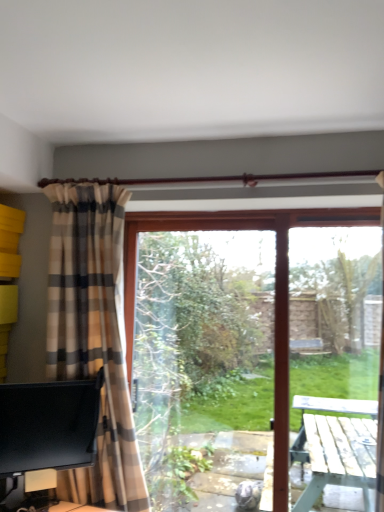
Question: From a real-world perspective, is transparent glass window screen at center on top of black glossy monitor at lower left?

Choices:
 (A) no
 (B) yes

Answer: (B)

Question: Is transparent glass window screen at center positioned behind black glossy monitor at lower left?

Choices:
 (A) no
 (B) yes

Answer: (B)

Question: Does transparent glass window screen at center have a lesser width compared to black glossy monitor at lower left?

Choices:
 (A) yes
 (B) no

Answer: (B)

Question: Would you say transparent glass window screen at center is a long distance from black glossy monitor at lower left?

Choices:
 (A) no
 (B) yes

Answer: (A)

Question: Does transparent glass window screen at center have a smaller size compared to black glossy monitor at lower left?

Choices:
 (A) no
 (B) yes

Answer: (A)

Question: Would you say transparent glass window screen at center is inside or outside transparent glass screen door at right?

Choices:
 (A) inside
 (B) outside

Answer: (B)

Question: From a real-world perspective, is transparent glass window screen at center positioned above or below transparent glass screen door at right?

Choices:
 (A) below
 (B) above

Answer: (A)

Question: From their relative heights in the image, would you say transparent glass window screen at center is taller or shorter than transparent glass screen door at right?

Choices:
 (A) short
 (B) tall

Answer: (B)

Question: Is point click(243, 279) positioned closer to the camera than point click(319, 449)?

Choices:
 (A) farther
 (B) closer

Answer: (B)

Question: Does point (117, 504) appear closer or farther from the camera than point (246, 234)?

Choices:
 (A) farther
 (B) closer

Answer: (B)

Question: Is plaid fabric curtain at left in front of or behind transparent glass window screen at center in the image?

Choices:
 (A) behind
 (B) front

Answer: (B)

Question: From the image's perspective, is plaid fabric curtain at left above or below transparent glass window screen at center?

Choices:
 (A) below
 (B) above

Answer: (B)

Question: From a real-world perspective, relative to transparent glass window screen at center, is plaid fabric curtain at left vertically above or below?

Choices:
 (A) above
 (B) below

Answer: (A)

Question: In terms of width, does transparent glass window screen at center look wider or thinner when compared to black glossy monitor at lower left?

Choices:
 (A) wide
 (B) thin

Answer: (A)

Question: In terms of height, does transparent glass window screen at center look taller or shorter compared to black glossy monitor at lower left?

Choices:
 (A) tall
 (B) short

Answer: (A)